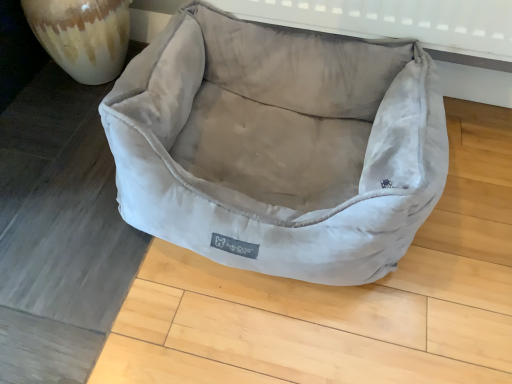
Question: Considering their positions, is marbled ceramic vase at left located in front of or behind suede-like beige dog bed at center?

Choices:
 (A) behind
 (B) front

Answer: (A)

Question: Would you say marbled ceramic vase at left is inside or outside suede-like beige dog bed at center?

Choices:
 (A) outside
 (B) inside

Answer: (A)

Question: Is marbled ceramic vase at left wider or thinner than suede-like beige dog bed at center?

Choices:
 (A) thin
 (B) wide

Answer: (A)

Question: Is suede-like beige dog bed at center inside or outside of marbled ceramic vase at left?

Choices:
 (A) inside
 (B) outside

Answer: (B)

Question: In the image, is suede-like beige dog bed at center positioned in front of or behind marbled ceramic vase at left?

Choices:
 (A) behind
 (B) front

Answer: (B)

Question: Is point click(x=351, y=162) closer or farther from the camera than point click(x=111, y=77)?

Choices:
 (A) closer
 (B) farther

Answer: (A)

Question: Based on their sizes in the image, would you say suede-like beige dog bed at center is bigger or smaller than marbled ceramic vase at left?

Choices:
 (A) small
 (B) big

Answer: (B)